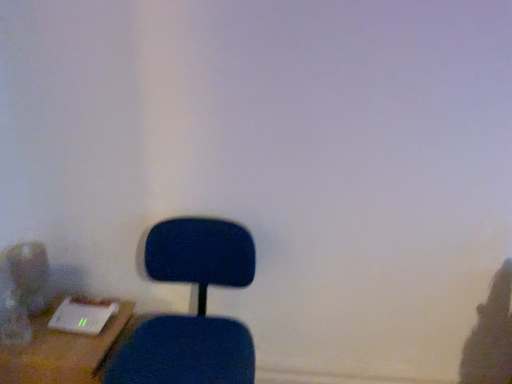
What do you see at coordinates (61, 352) in the screenshot? Image resolution: width=512 pixels, height=384 pixels. I see `wooden desk at lower left` at bounding box center [61, 352].

At what (x,y) coordinates should I click in order to perform the action: click on wooden desk at lower left. Please return your answer as a coordinate pair (x, y). The image size is (512, 384). Looking at the image, I should click on (61, 352).

Where is `blue fabric chair at lower left`? The height and width of the screenshot is (384, 512). blue fabric chair at lower left is located at coordinates (197, 309).

Describe the element at coordinates (197, 309) in the screenshot. This screenshot has width=512, height=384. I see `blue fabric chair at lower left` at that location.

Locate an element on the screen. This screenshot has height=384, width=512. wooden desk at lower left is located at coordinates (61, 352).

From the picture: Between wooden desk at lower left and blue fabric chair at lower left, which one appears on the left side from the viewer's perspective?

wooden desk at lower left is more to the left.

Which object is more forward, wooden desk at lower left or blue fabric chair at lower left?

blue fabric chair at lower left is in front.

Considering the positions of points (16, 371) and (251, 247), is point (16, 371) closer to camera compared to point (251, 247)?

Yes.

From the image's perspective, would you say wooden desk at lower left is shown under blue fabric chair at lower left?

Yes, from the image's perspective, wooden desk at lower left is below blue fabric chair at lower left.

From a real-world perspective, who is located higher, wooden desk at lower left or blue fabric chair at lower left?

In real-world perspective, blue fabric chair at lower left is above.

Considering the relative sizes of wooden desk at lower left and blue fabric chair at lower left in the image provided, is wooden desk at lower left thinner than blue fabric chair at lower left?

Yes, wooden desk at lower left is thinner than blue fabric chair at lower left.

Considering the relative sizes of wooden desk at lower left and blue fabric chair at lower left in the image provided, is wooden desk at lower left shorter than blue fabric chair at lower left?

Yes.

Can you confirm if wooden desk at lower left is bigger than blue fabric chair at lower left?

Actually, wooden desk at lower left might be smaller than blue fabric chair at lower left.

Do you think wooden desk at lower left is within blue fabric chair at lower left, or outside of it?

wooden desk at lower left is not enclosed by blue fabric chair at lower left.

Can you see wooden desk at lower left touching blue fabric chair at lower left?

No, wooden desk at lower left is not with blue fabric chair at lower left.

Does wooden desk at lower left turn towards blue fabric chair at lower left?

Yes.

How many degrees apart are the facing directions of wooden desk at lower left and blue fabric chair at lower left?

The facing directions of wooden desk at lower left and blue fabric chair at lower left are 87 degrees apart.

This screenshot has height=384, width=512. What are the coordinates of `furniture on the left of the blue fabric chair at lower left` in the screenshot? It's located at (61, 352).

Is blue fabric chair at lower left at the right side of wooden desk at lower left?

Yes, blue fabric chair at lower left is to the right of wooden desk at lower left.

Is blue fabric chair at lower left positioned before wooden desk at lower left?

Yes, blue fabric chair at lower left is closer to the camera.

Does point (247, 358) come farther from viewer compared to point (41, 370)?

No, (247, 358) is in front of (41, 370).

From the image's perspective, between blue fabric chair at lower left and wooden desk at lower left, who is located below?

wooden desk at lower left is shown below in the image.

From a real-world perspective, who is located lower, blue fabric chair at lower left or wooden desk at lower left?

From a 3D spatial view, wooden desk at lower left is below.

Between blue fabric chair at lower left and wooden desk at lower left, which one has larger width?

Wider between the two is blue fabric chair at lower left.

Can you confirm if blue fabric chair at lower left is taller than wooden desk at lower left?

Correct, blue fabric chair at lower left is much taller as wooden desk at lower left.

Can you confirm if blue fabric chair at lower left is smaller than wooden desk at lower left?

No.

Consider the image. Can we say blue fabric chair at lower left lies outside wooden desk at lower left?

Indeed, blue fabric chair at lower left is completely outside wooden desk at lower left.

Is blue fabric chair at lower left not near wooden desk at lower left?

No, blue fabric chair at lower left is not far from wooden desk at lower left.

Could you tell me if blue fabric chair at lower left is facing wooden desk at lower left?

No, blue fabric chair at lower left does not turn towards wooden desk at lower left.

In the scene shown: How many degrees apart are the facing directions of blue fabric chair at lower left and wooden desk at lower left?

87 degrees.

In the image, there is a blue fabric chair at lower left. At what (x,y) coordinates should I click in order to perform the action: click on furniture below it (from a real-world perspective). Please return your answer as a coordinate pair (x, y). Looking at the image, I should click on (61, 352).

Where is `furniture on the left of blue fabric chair at lower left`? furniture on the left of blue fabric chair at lower left is located at coordinates point(61,352).

You are a GUI agent. You are given a task and a screenshot of the screen. Output one action in this format:
    pyautogui.click(x=<x>, y=<y>)
    Task: Click on the furniture that is under the blue fabric chair at lower left (from a real-world perspective)
    
    Given the screenshot: What is the action you would take?
    pyautogui.click(x=61, y=352)